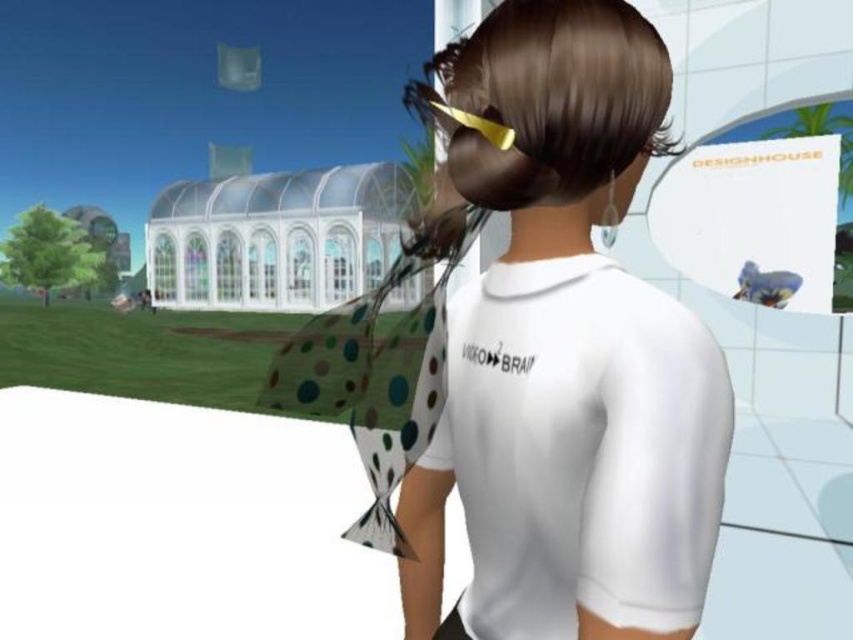
Question: Is white matte shirt at center to the right of shiny gold hair clip at upper center from the viewer's perspective?

Choices:
 (A) yes
 (B) no

Answer: (B)

Question: Is white matte shirt at center behind shiny gold hair clip at upper center?

Choices:
 (A) no
 (B) yes

Answer: (A)

Question: Can you confirm if white matte shirt at center is smaller than shiny gold hair clip at upper center?

Choices:
 (A) no
 (B) yes

Answer: (B)

Question: Which point is closer to the camera?

Choices:
 (A) white matte shirt at center
 (B) shiny gold hair clip at upper center

Answer: (A)

Question: Which point appears farthest from the camera in this image?

Choices:
 (A) (512, 435)
 (B) (546, 60)

Answer: (A)